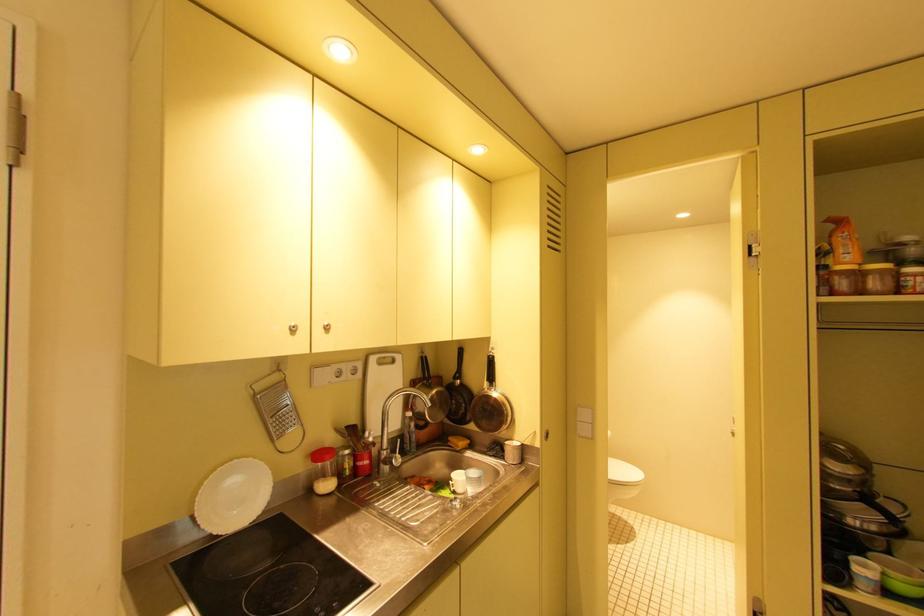
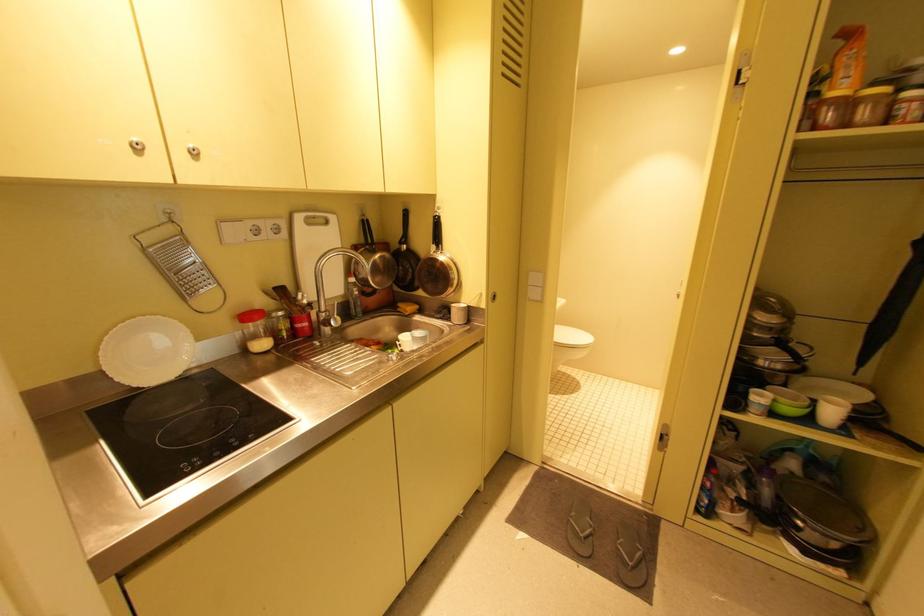
In a continuous first-person perspective shot, in which direction is the camera moving?

The movement direction of the cameraman is right, forward.